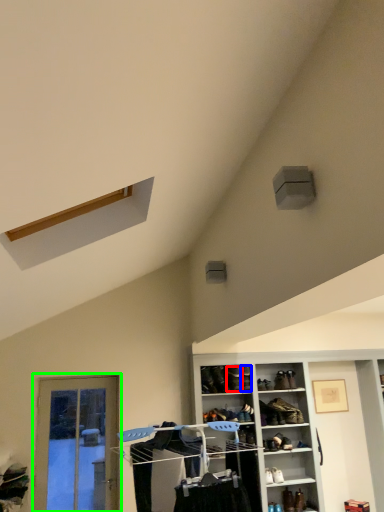
Question: Estimate the real-world distances between objects in this image. Which object is closer to shoe (highlighted by a red box), shoe (highlighted by a blue box) or screen door (highlighted by a green box)?

Choices:
 (A) shoe
 (B) screen door

Answer: (A)